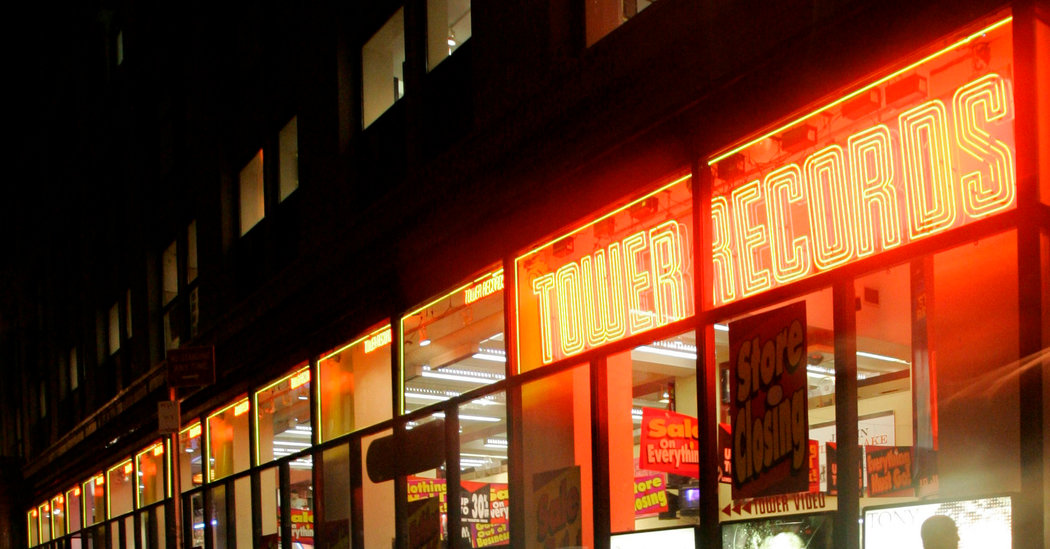
Locate an element on the screen. The image size is (1050, 549). front door is located at coordinates (420, 522).